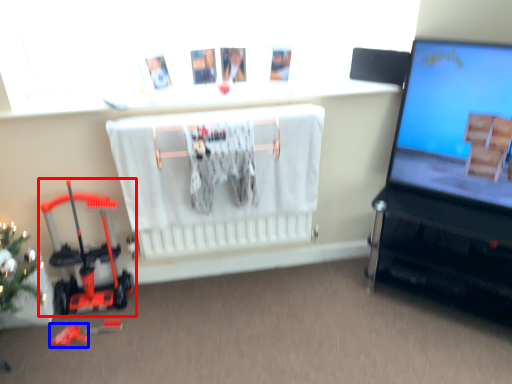
Question: Which object is closer to the camera taking this photo, toy (highlighted by a red box) or toy (highlighted by a blue box)?

Choices:
 (A) toy
 (B) toy

Answer: (A)